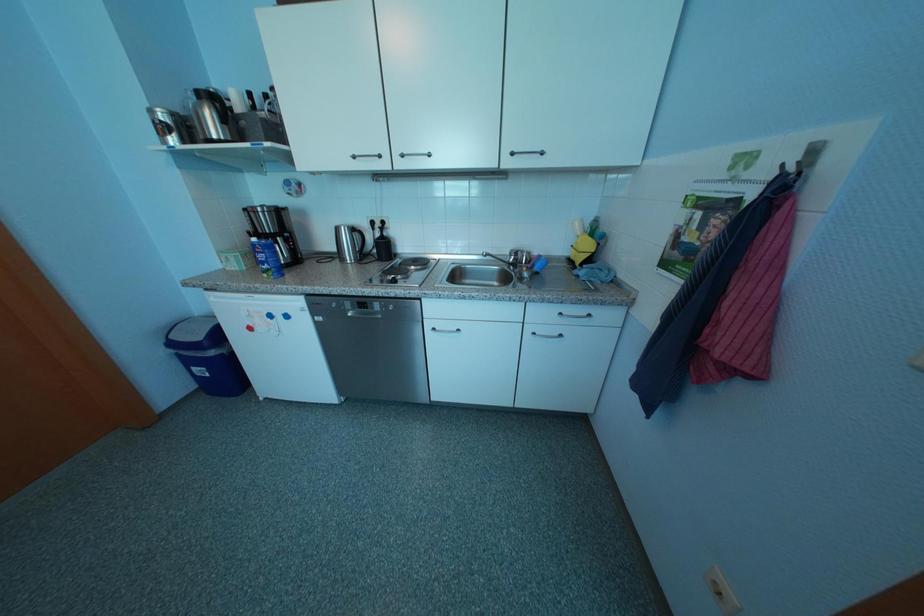
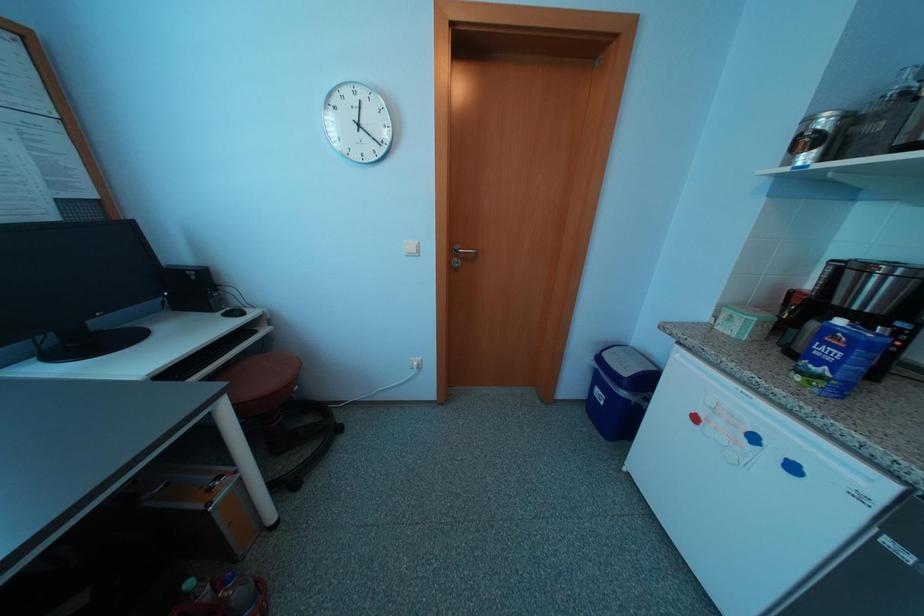
The first image is from the beginning of the video and the second image is from the end. How did the camera likely rotate when shooting the video?

The camera's rotation is toward left-down.